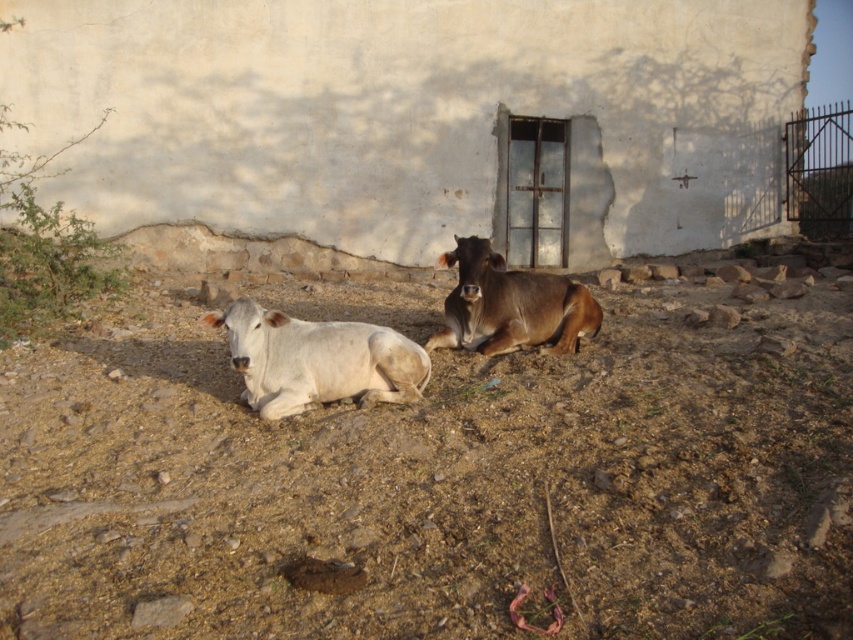
You are a farmer checking the condition of your animals. You notice the white smooth cow at center is lying on the brown soil at center. Based on the scene, is the soil underneath the cow likely to be soft or hard?

The brown soil at center is positioned under the white smooth cow at center. Since the cow is lying on it and the ground is described as dry, rocky, and covered with stones, the soil is likely hard.

You are a farmer checking the condition of your farm. You see the brown soil at center and the brown glossy bull at center. Which one has a greater width?

The brown soil at center might be wider than brown glossy bull at center according to the description.

You are standing at the origin point of the image coordinate system. You want to walk to the white smooth cow at center. What are the coordinates you need to move to?

You need to move to the coordinates point at 0.564 on the x axis and 0.373 on the y axis to reach the white smooth cow at center.